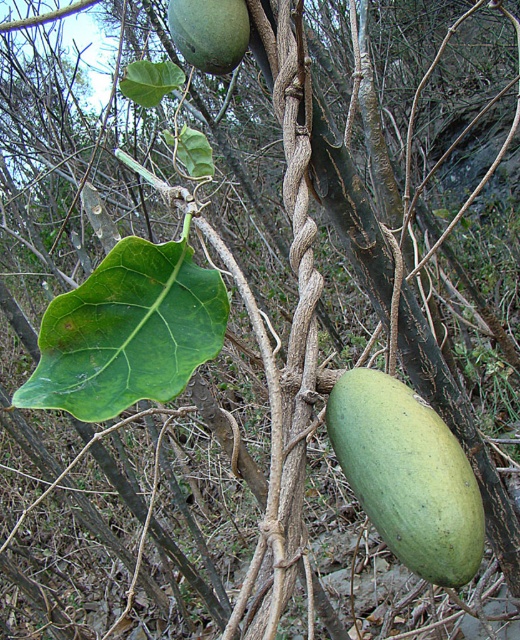
Question: Which point is closer to the camera?

Choices:
 (A) green matte/glossy gourd at center-right
 (B) green smooth leaf at center
 (C) green matte/glossy fruit at upper center

Answer: (B)

Question: Among these objects, which one is farthest from the camera?

Choices:
 (A) green smooth leaf at center
 (B) green matte/glossy fruit at upper center
 (C) green matte/glossy gourd at center-right

Answer: (B)

Question: Which object is the closest to the green smooth leaf at center?

Choices:
 (A) green matte/glossy gourd at center-right
 (B) green matte/glossy fruit at upper center

Answer: (A)

Question: Can you confirm if green smooth leaf at center is positioned to the right of green matte/glossy gourd at center-right?

Choices:
 (A) no
 (B) yes

Answer: (A)

Question: Can you confirm if green matte/glossy gourd at center-right is positioned below green matte/glossy fruit at upper center?

Choices:
 (A) yes
 (B) no

Answer: (A)

Question: Where is green smooth leaf at center located in relation to green matte/glossy gourd at center-right in the image?

Choices:
 (A) left
 (B) right

Answer: (A)